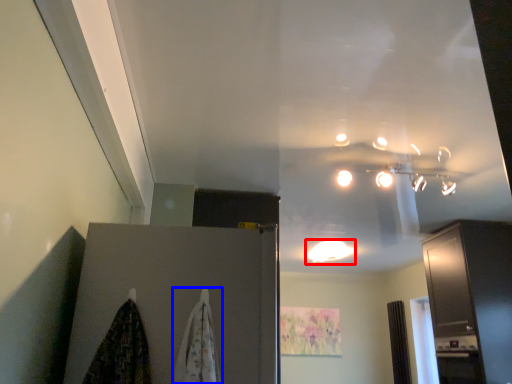
Question: Which of the following is the farthest to the observer, lighting (highlighted by a red box) or curtain (highlighted by a blue box)?

Choices:
 (A) lighting
 (B) curtain

Answer: (A)